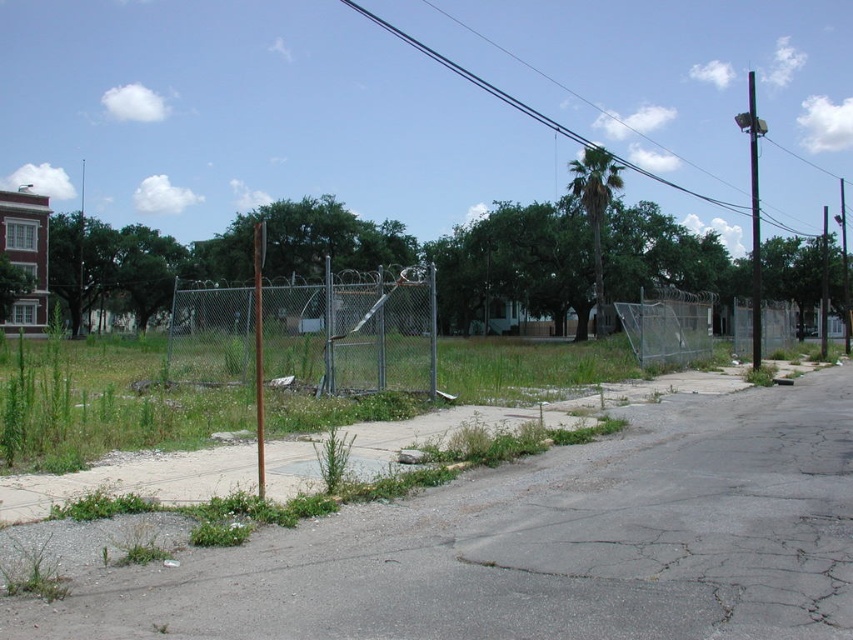
You are standing at the center of the cracked asphalt road in the urban scene. There is a green grass at lower left located at point (32, 572). Can you walk directly to that point from your current position?

The green grass at lower left is located at point (32, 572). Since the cracked asphalt road is in the foreground and the green grass is at lower left on the road, you can walk directly to that point as it is on the same road surface.

You are standing at the point marked as point (310,332) in the image. What object are you directly facing?

The point (310,332) corresponds to the green chain link fence at center, so you are directly facing the green chain link fence at center.

You are standing at the edge of the fenced area and want to take a photo of both the cracked asphalt road and the overgrown field. Which point, point (x=364, y=314) or point (x=67, y=588), should you focus on to ensure both areas are in the frame?

You should focus on point (x=67, y=588) because it is closer to the camera, allowing both the cracked asphalt road and the overgrown field to be in the frame.